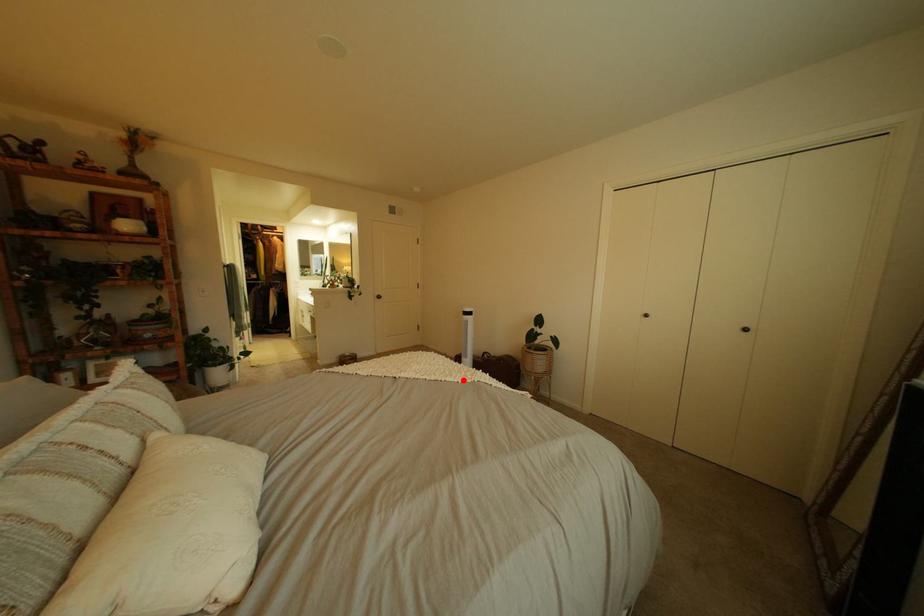
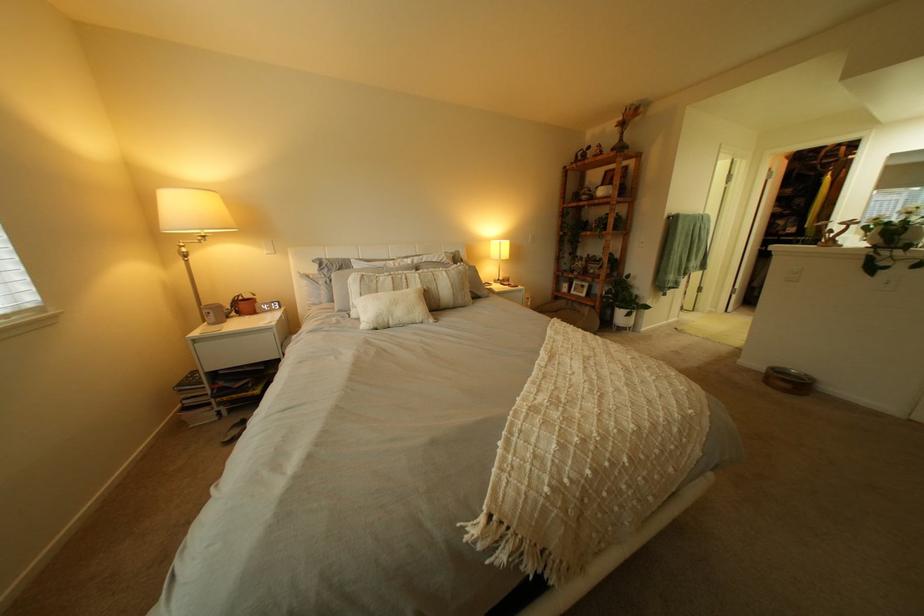
Question: I am providing you with two images of the same scene from different viewpoints. A red point is shown in image1. For the corresponding object point in image2, is it positioned nearer or farther from the camera?

Choices:
 (A) Nearer
 (B) Farther

Answer: (B)